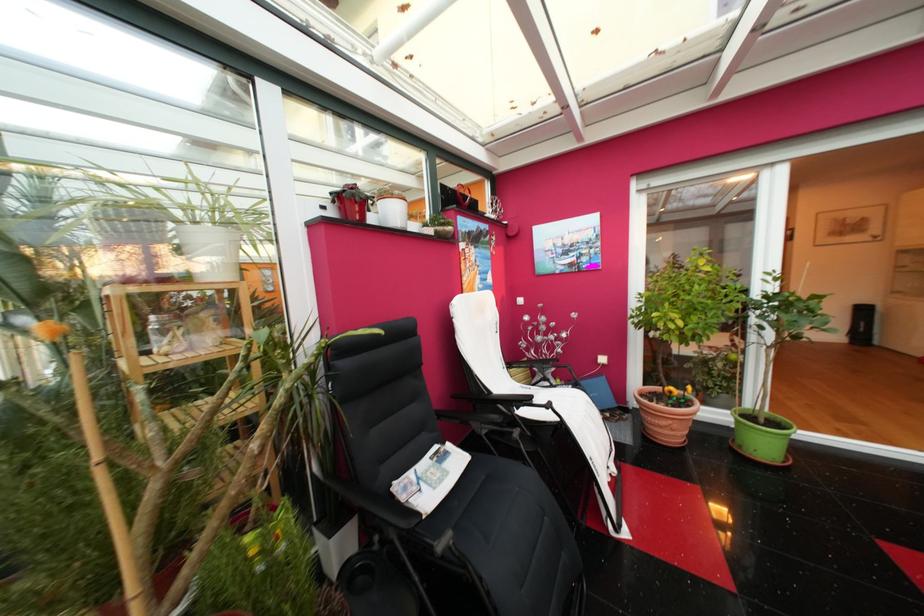
What do you see at coordinates (394, 214) in the screenshot? I see `the cup holder` at bounding box center [394, 214].